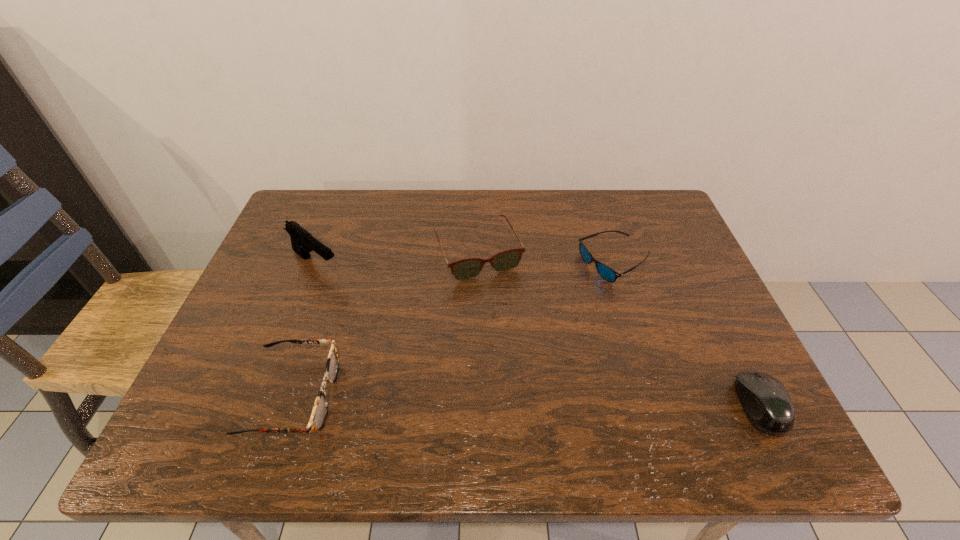
Where is `vacant space on the desktop that is between the left spectacles and the mouse and is positioned at the front view of the right spectacles`? The height and width of the screenshot is (540, 960). vacant space on the desktop that is between the left spectacles and the mouse and is positioned at the front view of the right spectacles is located at coordinates (545, 401).

This screenshot has width=960, height=540. I want to click on vacant space on the desktop that is between the nearer spectacles and the mouse and is positioned on the front-facing side of the tallest object, so click(489, 400).

This screenshot has width=960, height=540. I want to click on free spot on the desktop that is between the nearer spectacles and the mouse and is positioned at the front of the shortest object showing the lenses, so click(565, 402).